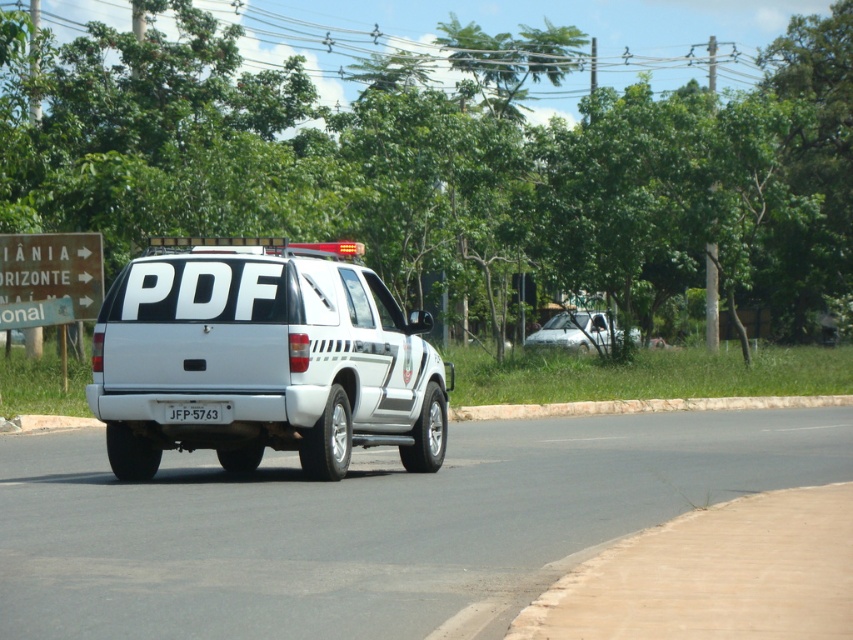
Question: Which of these objects is positioned farthest from the white matte truck at center?

Choices:
 (A) green wooden sign at upper left
 (B) white plastic license plate at center

Answer: (B)

Question: Is white matte suv at center to the right of white plastic license plate at center from the viewer's perspective?

Choices:
 (A) yes
 (B) no

Answer: (A)

Question: Is white matte suv at center above white plastic license plate at center?

Choices:
 (A) no
 (B) yes

Answer: (B)

Question: Can you confirm if white matte suv at center is thinner than white plastic license plate at center?

Choices:
 (A) no
 (B) yes

Answer: (A)

Question: Which point is closer to the camera?

Choices:
 (A) white plastic license plate at center
 (B) green wooden sign at upper left
 (C) white matte suv at center

Answer: (C)

Question: Which point appears closest to the camera in this image?

Choices:
 (A) tap(35, 289)
 (B) tap(136, 284)
 (C) tap(194, 417)

Answer: (C)